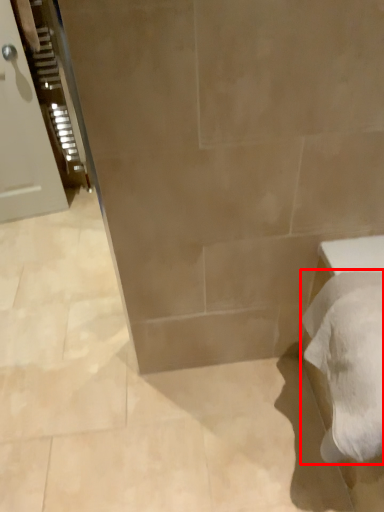
Question: In this image, where is bath towel (annotated by the red box) located relative to door?

Choices:
 (A) right
 (B) left

Answer: (A)